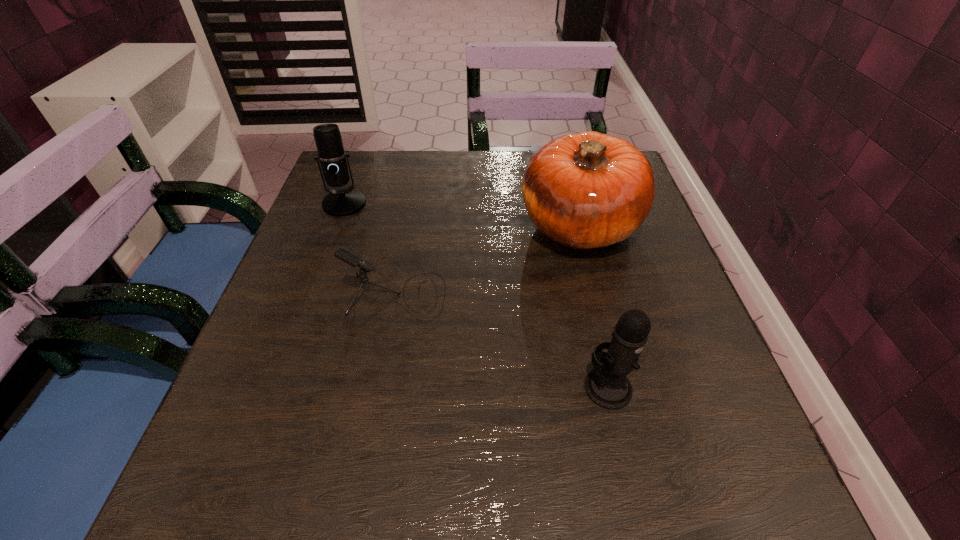
At what (x,y) coordinates should I click in order to perform the action: click on vacant region between the pumpkin and the leftmost microphone. Please return your answer as a coordinate pair (x, y). The width and height of the screenshot is (960, 540). Looking at the image, I should click on coord(462,214).

At what (x,y) coordinates should I click in order to perform the action: click on unoccupied area between the second nearest microphone and the leftmost object. Please return your answer as a coordinate pair (x, y). Looking at the image, I should click on point(370,249).

Locate an element on the screen. free point between the second microphone from right to left and the farthest microphone is located at coordinates (370, 249).

Image resolution: width=960 pixels, height=540 pixels. Find the location of `the closest object to the farthest microphone`. the closest object to the farthest microphone is located at coordinates tap(345, 255).

Identify the location of object that is the third closest to the nearest object. (332, 164).

Identify which microphone is the second closest to the third object from right to left. Please provide its 2D coordinates. Your answer should be formatted as a tuple, i.e. [(x, y)], where the tuple contains the x and y coordinates of a point satisfying the conditions above.

[(606, 385)]

Point out which microphone is positioned as the nearest to the farthest microphone. Please provide its 2D coordinates. Your answer should be formatted as a tuple, i.e. [(x, y)], where the tuple contains the x and y coordinates of a point satisfying the conditions above.

[(345, 255)]

What are the coordinates of `vacant region that satisfies the following two spatial constraints: 1. on the front side of the pumpkin; 2. on the stand of the third object from right to left` in the screenshot? It's located at (598, 295).

This screenshot has width=960, height=540. Find the location of `free spot that satisfies the following two spatial constraints: 1. on the stand of the second microphone from left to right; 2. on the right side of the rightmost microphone`. free spot that satisfies the following two spatial constraints: 1. on the stand of the second microphone from left to right; 2. on the right side of the rightmost microphone is located at coordinates (379, 387).

Locate an element on the screen. Image resolution: width=960 pixels, height=540 pixels. vacant space that satisfies the following two spatial constraints: 1. on the stand of the nearest microphone; 2. on the right side of the second farthest microphone is located at coordinates (379, 387).